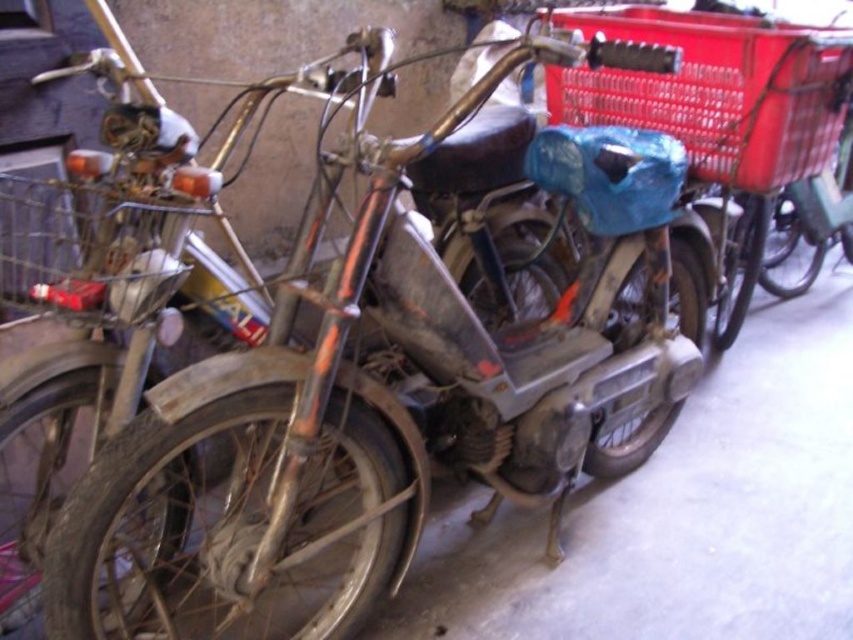
Can you confirm if red plastic basket at upper right is positioned to the left of metallic wire basket at left?

Incorrect, red plastic basket at upper right is not on the left side of metallic wire basket at left.

Is red plastic basket at upper right below metallic wire basket at left?

No, red plastic basket at upper right is not below metallic wire basket at left.

Is point (567, 17) closer to viewer compared to point (171, 288)?

No, (567, 17) is behind (171, 288).

This screenshot has width=853, height=640. Identify the location of red plastic basket at upper right. click(x=717, y=90).